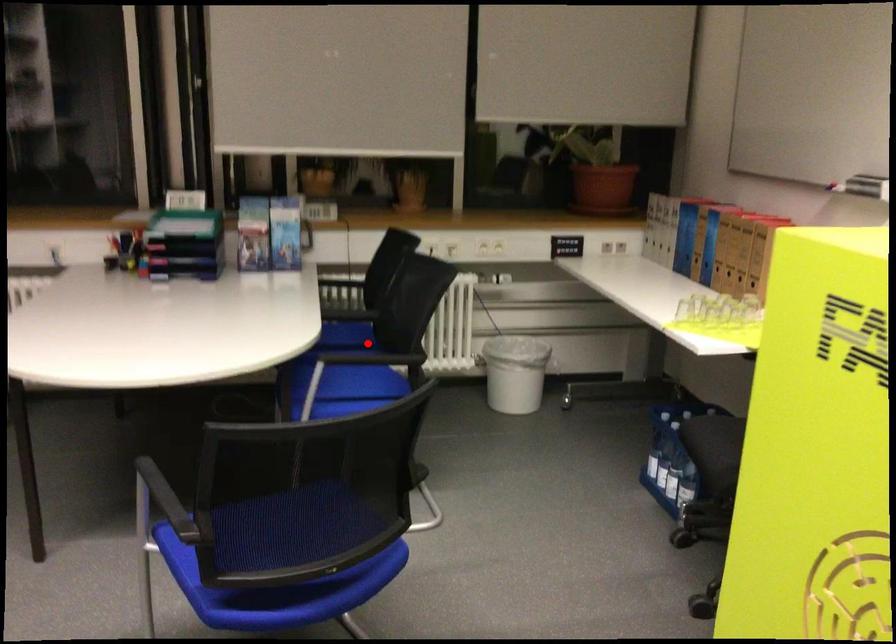
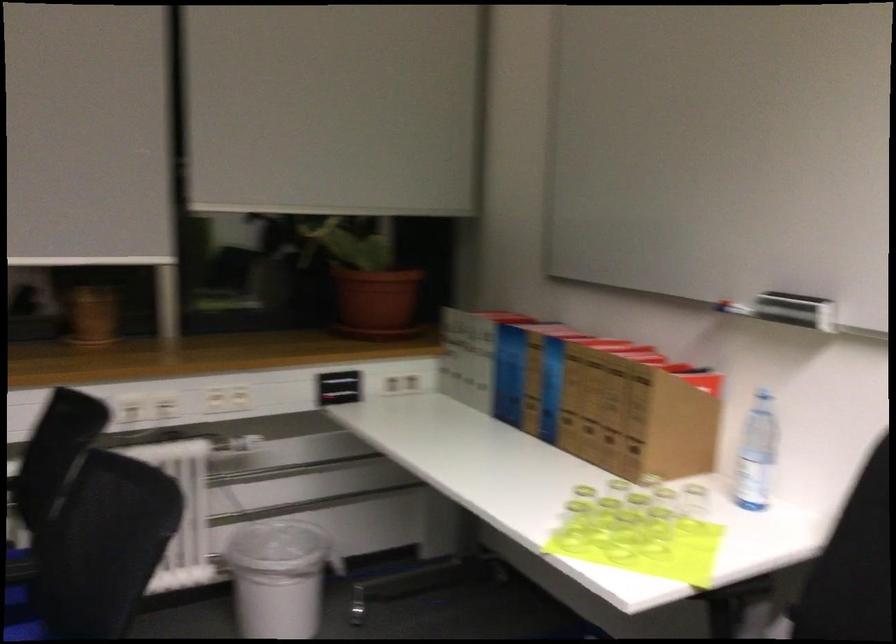
Question: A red point is marked in image1. In image2, is the corresponding 3D point closer to the camera or farther? Reply with the corresponding letter.

Choices:
 (A) The corresponding 3D point is closer.
 (B) The corresponding 3D point is farther.

Answer: (A)